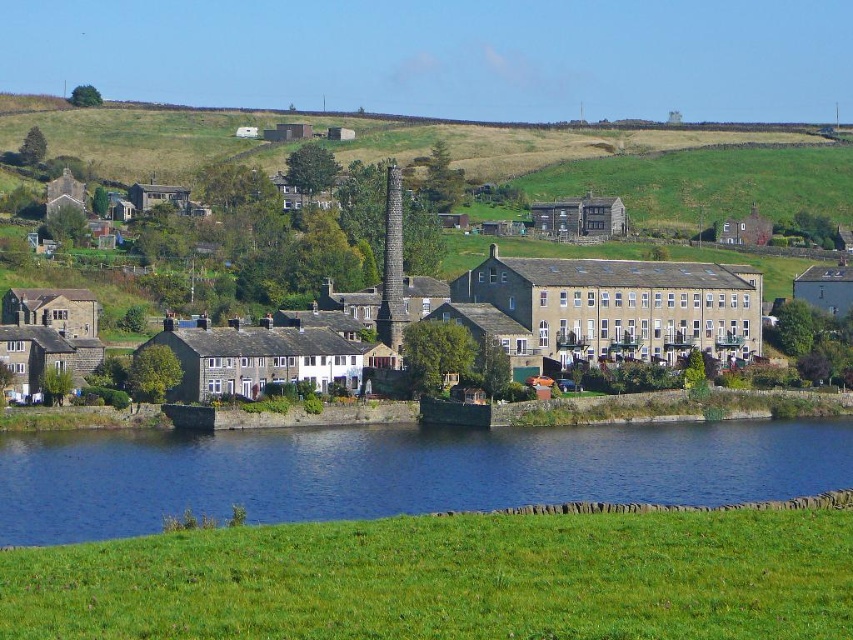
Question: Which point is closer to the camera taking this photo?

Choices:
 (A) (728, 356)
 (B) (91, 481)

Answer: (B)

Question: Which object is farther from the camera taking this photo?

Choices:
 (A) stone buildings at center
 (B) blue water at lower center

Answer: (A)

Question: Which point appears closest to the camera in this image?

Choices:
 (A) (619, 355)
 (B) (306, 436)

Answer: (B)

Question: Where is blue water at lower center located in relation to stone buildings at center in the image?

Choices:
 (A) left
 (B) right

Answer: (B)

Question: Does blue water at lower center appear over stone buildings at center?

Choices:
 (A) no
 (B) yes

Answer: (A)

Question: Can you confirm if blue water at lower center is positioned to the right of stone buildings at center?

Choices:
 (A) yes
 (B) no

Answer: (A)